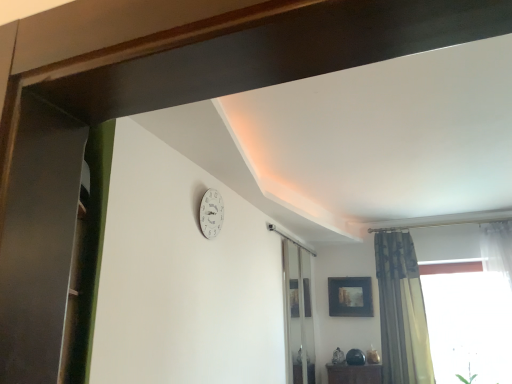
Question: From the image's perspective, is transparent glass screen door at center, which is the first screen door from bottom to top, above white matte clock at upper center?

Choices:
 (A) no
 (B) yes

Answer: (A)

Question: Is transparent glass screen door at center, placed as the second screen door when sorted from left to right, aimed at white matte clock at upper center?

Choices:
 (A) yes
 (B) no

Answer: (B)

Question: Can you confirm if transparent glass screen door at center, which appears as the second screen door when viewed from the top, is smaller than white matte clock at upper center?

Choices:
 (A) yes
 (B) no

Answer: (B)

Question: Can we say transparent glass screen door at center, which appears as the second screen door when viewed from the top, lies outside white matte clock at upper center?

Choices:
 (A) no
 (B) yes

Answer: (B)

Question: Is transparent glass screen door at center, which is the 1th screen door in back-to-front order, positioned before white matte clock at upper center?

Choices:
 (A) no
 (B) yes

Answer: (A)

Question: Considering the relative positions of transparent glass screen door at center, the 1th screen door from the right, and white matte clock at upper center in the image provided, is transparent glass screen door at center, the 1th screen door from the right, to the left of white matte clock at upper center from the viewer's perspective?

Choices:
 (A) yes
 (B) no

Answer: (B)

Question: From the image's perspective, is white matte clock at upper center below transparent glass screen door at center, the 2th screen door viewed from the front?

Choices:
 (A) no
 (B) yes

Answer: (A)

Question: Is white matte clock at upper center shorter than transparent glass screen door at center, the 2th screen door viewed from the front?

Choices:
 (A) yes
 (B) no

Answer: (A)

Question: Would you say transparent glass screen door at center, the 2th screen door viewed from the front, is part of white matte clock at upper center's contents?

Choices:
 (A) yes
 (B) no

Answer: (B)

Question: Can you confirm if white matte clock at upper center is bigger than transparent glass screen door at center, which appears as the second screen door when viewed from the top?

Choices:
 (A) no
 (B) yes

Answer: (A)

Question: Is there a large distance between white matte clock at upper center and transparent glass screen door at center, which is the first screen door from bottom to top?

Choices:
 (A) yes
 (B) no

Answer: (A)

Question: From the image's perspective, is white matte clock at upper center over transparent glass screen door at center, which appears as the second screen door when viewed from the top?

Choices:
 (A) yes
 (B) no

Answer: (A)

Question: Is transparent glass screen door at center, which appears as the second screen door when viewed from the top, to the right of textured beige curtain at right from the viewer's perspective?

Choices:
 (A) no
 (B) yes

Answer: (A)